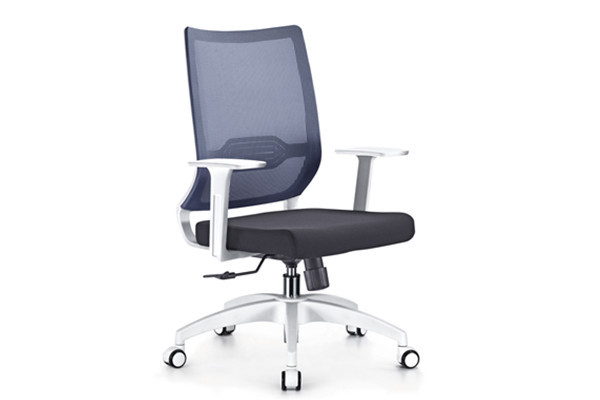
Locate an element on the screen. black stripe around chair back rest is located at coordinates (276, 30), (314, 114), (249, 200).